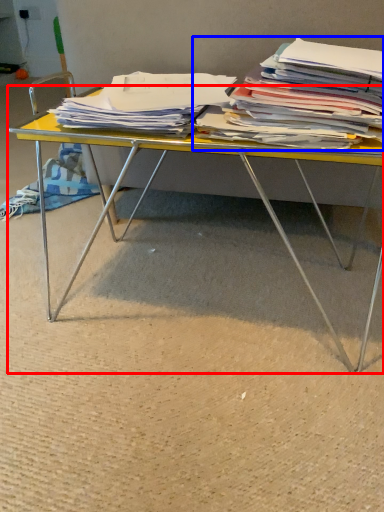
Question: Among these objects, which one is nearest to the camera, desk (highlighted by a red box) or magazine (highlighted by a blue box)?

Choices:
 (A) desk
 (B) magazine

Answer: (B)